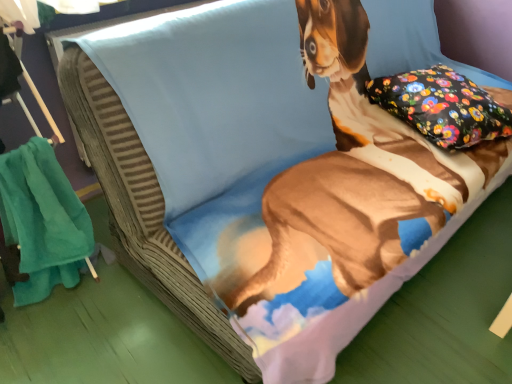
Question: Could you tell me if floral fabric pillow at upper right is facing teal soft towel at left?

Choices:
 (A) yes
 (B) no

Answer: (B)

Question: Is teal soft towel at left at the back of floral fabric pillow at upper right?

Choices:
 (A) no
 (B) yes

Answer: (A)

Question: Considering the relative sizes of floral fabric pillow at upper right and teal soft towel at left in the image provided, is floral fabric pillow at upper right smaller than teal soft towel at left?

Choices:
 (A) no
 (B) yes

Answer: (A)

Question: Would you say floral fabric pillow at upper right contains teal soft towel at left?

Choices:
 (A) no
 (B) yes

Answer: (A)

Question: Is floral fabric pillow at upper right not within teal soft towel at left?

Choices:
 (A) no
 (B) yes

Answer: (B)

Question: Considering the relative positions of floral fabric pillow at upper right and teal soft towel at left in the image provided, is floral fabric pillow at upper right to the right of teal soft towel at left from the viewer's perspective?

Choices:
 (A) no
 (B) yes

Answer: (B)

Question: Can you confirm if teal soft towel at left is smaller than floral fabric pillow at upper right?

Choices:
 (A) yes
 (B) no

Answer: (A)

Question: Could floral fabric pillow at upper right be considered to be inside teal soft towel at left?

Choices:
 (A) yes
 (B) no

Answer: (B)

Question: Does teal soft towel at left have a lesser width compared to floral fabric pillow at upper right?

Choices:
 (A) yes
 (B) no

Answer: (A)

Question: From the image's perspective, is teal soft towel at left above floral fabric pillow at upper right?

Choices:
 (A) yes
 (B) no

Answer: (B)

Question: Is teal soft towel at left wider than floral fabric pillow at upper right?

Choices:
 (A) no
 (B) yes

Answer: (A)

Question: Is teal soft towel at left aimed at floral fabric pillow at upper right?

Choices:
 (A) no
 (B) yes

Answer: (A)

Question: Is point (443, 72) positioned closer to the camera than point (54, 271)?

Choices:
 (A) closer
 (B) farther

Answer: (B)